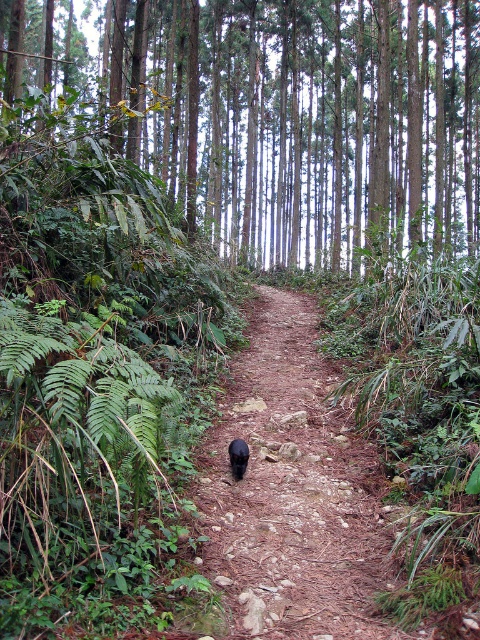
You are standing at the point marked by the coordinates point (280, 115). What object is located exactly at this point?

The green smooth trees at center are located exactly at point (280, 115).

You are a hiker who wants to take a photo of the black fur cat at center without stepping off the brown dirt path at center. Can you reach the cat within 30 centimeters distance while staying on the path?

The distance between the brown dirt path at center and the black fur cat at center is 31.20 centimeters. Since this is greater than 30 centimeters, you cannot reach the cat within that distance while staying on the path.